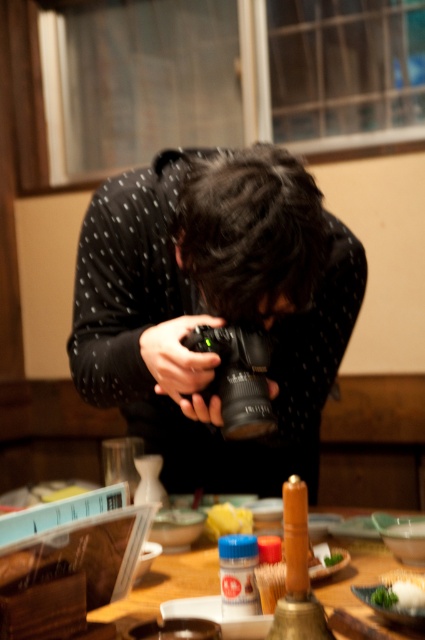
You are standing at the entrance of the restaurant and want to take a photo of the wooden table at center. Based on its position coordinates, is it closer to the left or right side of the room?

The wooden table at center is located at point 0.916 on the x and y axis, so it is closer to the right side of the room.

You are a photographer trying to capture the white matte rice at lower right in your shot. The black plastic camera at center is blocking your view. Can you move the camera to the side to get a clear shot of the rice?

The white matte rice at lower right is behind the black plastic camera at center, so moving the camera aside would allow you to see the rice clearly.

You are a photographer standing in the dining area. You have a black plastic camera at center and a wooden table at center in front of you. Which object is positioned to the right when you face the scene?

The wooden table at center is to the right of the black plastic camera at center.